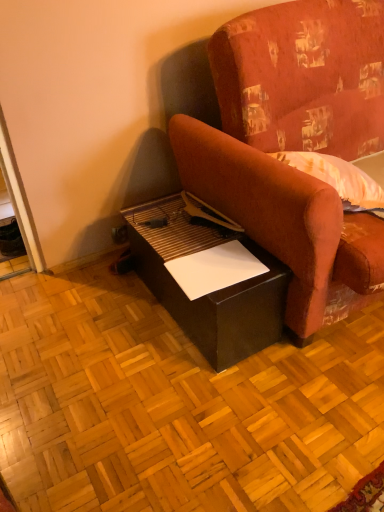
Question: Considering the relative positions of matte black table at lower center and velvet-like red couch at center in the image provided, is matte black table at lower center to the left of velvet-like red couch at center from the viewer's perspective?

Choices:
 (A) yes
 (B) no

Answer: (A)

Question: From the image's perspective, is matte black table at lower center beneath velvet-like red couch at center?

Choices:
 (A) yes
 (B) no

Answer: (A)

Question: Would you consider matte black table at lower center to be distant from velvet-like red couch at center?

Choices:
 (A) no
 (B) yes

Answer: (A)

Question: Does matte black table at lower center have a smaller size compared to velvet-like red couch at center?

Choices:
 (A) no
 (B) yes

Answer: (B)

Question: Considering the relative positions of matte black table at lower center and velvet-like red couch at center in the image provided, is matte black table at lower center to the right of velvet-like red couch at center from the viewer's perspective?

Choices:
 (A) no
 (B) yes

Answer: (A)

Question: Is matte black table at lower center positioned beyond the bounds of velvet-like red couch at center?

Choices:
 (A) yes
 (B) no

Answer: (A)

Question: Considering the relative sizes of velvet-like red couch at center and matte black table at lower center in the image provided, is velvet-like red couch at center shorter than matte black table at lower center?

Choices:
 (A) yes
 (B) no

Answer: (B)

Question: Is the position of velvet-like red couch at center less distant than that of matte black table at lower center?

Choices:
 (A) yes
 (B) no

Answer: (A)

Question: Considering the relative positions of velvet-like red couch at center and matte black table at lower center in the image provided, is velvet-like red couch at center to the right of matte black table at lower center from the viewer's perspective?

Choices:
 (A) yes
 (B) no

Answer: (A)

Question: Considering the relative sizes of velvet-like red couch at center and matte black table at lower center in the image provided, is velvet-like red couch at center taller than matte black table at lower center?

Choices:
 (A) no
 (B) yes

Answer: (B)

Question: Considering the relative sizes of velvet-like red couch at center and matte black table at lower center in the image provided, is velvet-like red couch at center thinner than matte black table at lower center?

Choices:
 (A) no
 (B) yes

Answer: (A)

Question: Is velvet-like red couch at center smaller than matte black table at lower center?

Choices:
 (A) yes
 (B) no

Answer: (B)

Question: Is matte black table at lower center inside or outside of velvet-like red couch at center?

Choices:
 (A) outside
 (B) inside

Answer: (A)